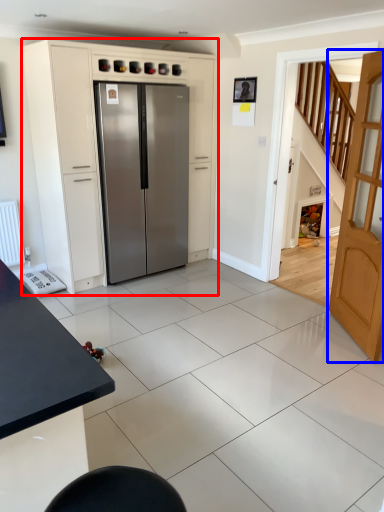
Question: Which object appears farthest to the camera in this image, cabinetry (highlighted by a red box) or door (highlighted by a blue box)?

Choices:
 (A) cabinetry
 (B) door

Answer: (A)